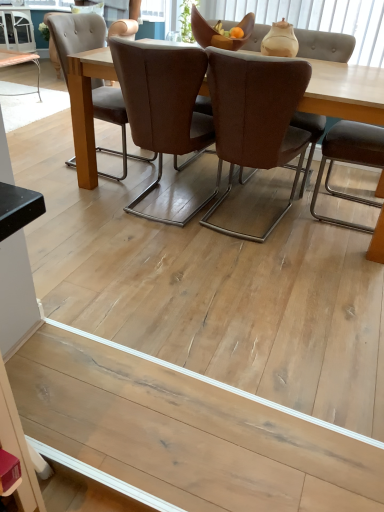
You are a GUI agent. You are given a task and a screenshot of the screen. Output one action in this format:
    pyautogui.click(x=<x>, y=<y>)
    Task: Click on the vacant area that lies in front of brown fabric chair at center, which appears as the second chair when viewed from the left
    The width and height of the screenshot is (384, 512).
    Given the screenshot: What is the action you would take?
    pyautogui.click(x=253, y=264)